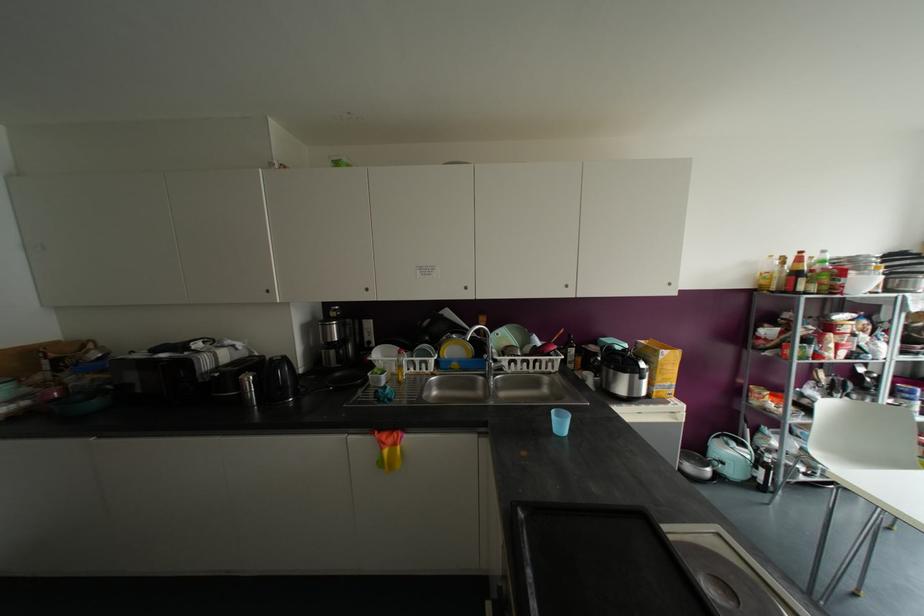
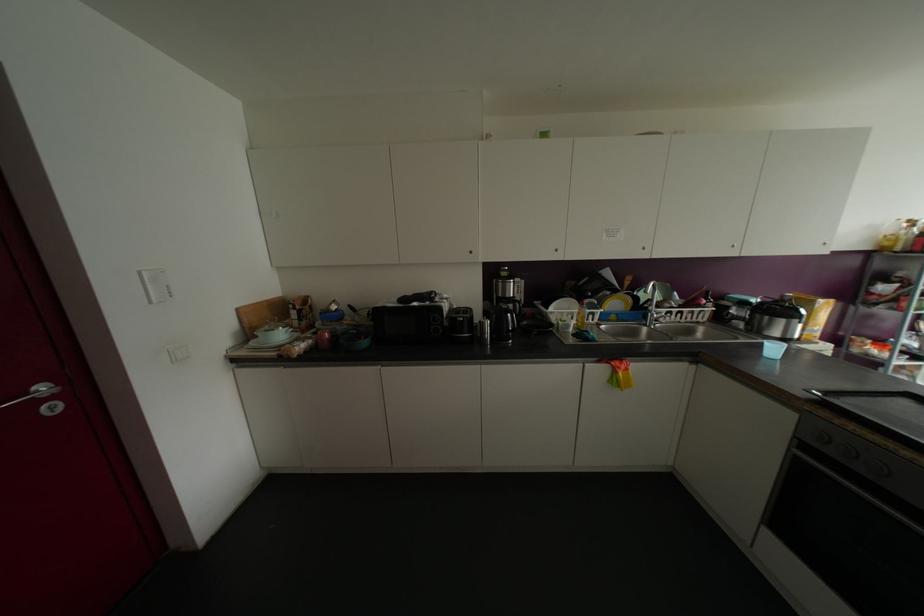
Find the pixel in the second image that matches (x=367, y=289) in the first image.

(555, 249)